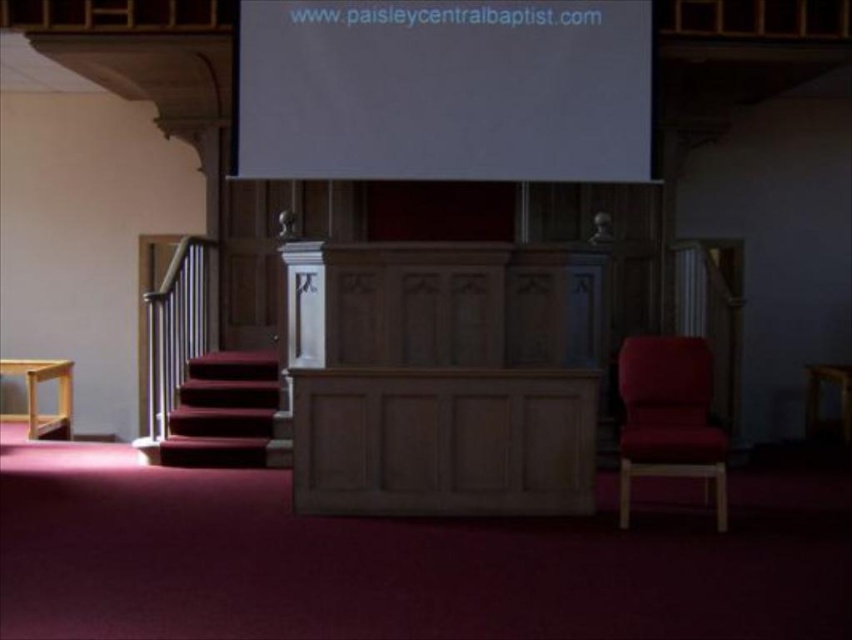
Who is taller, white matte projection screen at upper center or velvet red carpet at lower left?

white matte projection screen at upper center is taller.

Which is below, white matte projection screen at upper center or velvet red carpet at lower left?

velvet red carpet at lower left is lower down.

Find the location of a particular element. The image size is (852, 640). white matte projection screen at upper center is located at coordinates [442, 90].

Who is lower down, white matte projection screen at upper center or velvet red armchair at right?

velvet red armchair at right is below.

What are the coordinates of `white matte projection screen at upper center` in the screenshot? It's located at (442, 90).

Is velvet red armchair at right shorter than velvet red carpet at lower left?

No, velvet red armchair at right is not shorter than velvet red carpet at lower left.

Can you confirm if velvet red armchair at right is positioned to the left of velvet red carpet at lower left?

In fact, velvet red armchair at right is to the right of velvet red carpet at lower left.

Measure the distance between velvet red armchair at right and camera.

velvet red armchair at right and camera are 4.69 meters apart from each other.

Find the location of a particular element. velvet red armchair at right is located at coordinates (669, 417).